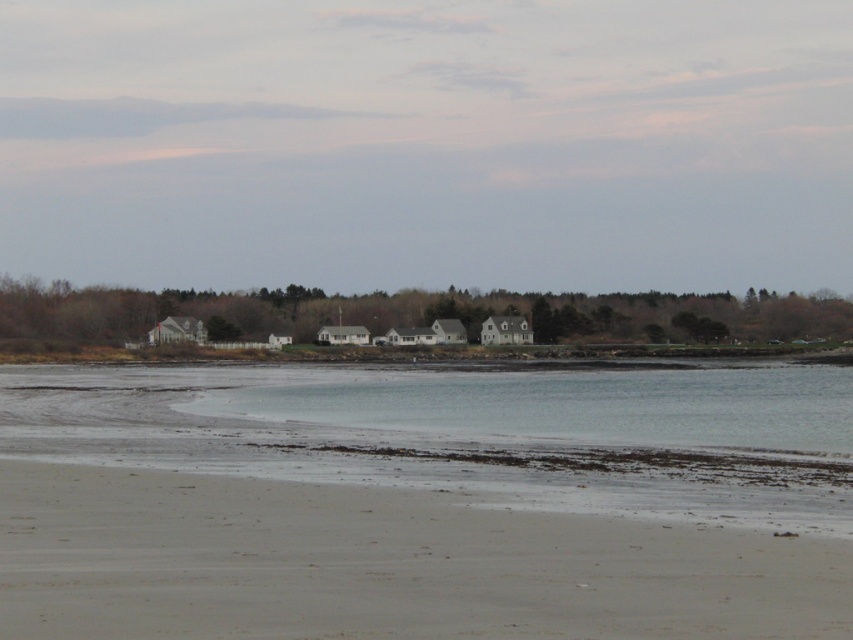
Can you confirm if sandy beach at lower left is shorter than clear water at lower center?

Indeed, sandy beach at lower left has a lesser height compared to clear water at lower center.

Is sandy beach at lower left closer to the viewer compared to clear water at lower center?

That is True.

At what (x,y) coordinates should I click in order to perform the action: click on sandy beach at lower left. Please return your answer as a coordinate pair (x, y). This screenshot has width=853, height=640. Looking at the image, I should click on (381, 564).